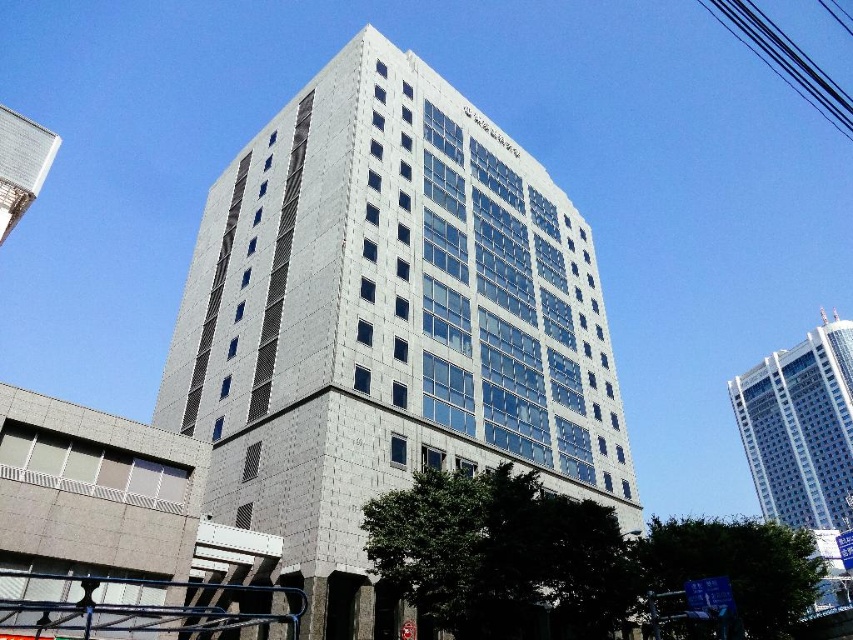
Question: Is white glass building at center closer to camera compared to metallic silver tower at upper left?

Choices:
 (A) no
 (B) yes

Answer: (A)

Question: Is white glass building at center below metallic silver tower at upper left?

Choices:
 (A) no
 (B) yes

Answer: (B)

Question: Which object appears farthest from the camera in this image?

Choices:
 (A) metallic silver tower at upper left
 (B) white glass building at upper right
 (C) white glass building at center

Answer: (B)

Question: Which object is the farthest from the metallic silver tower at upper left?

Choices:
 (A) white glass building at center
 (B) white glass building at upper right

Answer: (B)

Question: Which of the following is the closest to the observer?

Choices:
 (A) (35, 172)
 (B) (329, 538)
 (C) (799, 417)

Answer: (B)

Question: Does white glass building at center appear on the left side of metallic silver tower at upper left?

Choices:
 (A) no
 (B) yes

Answer: (A)